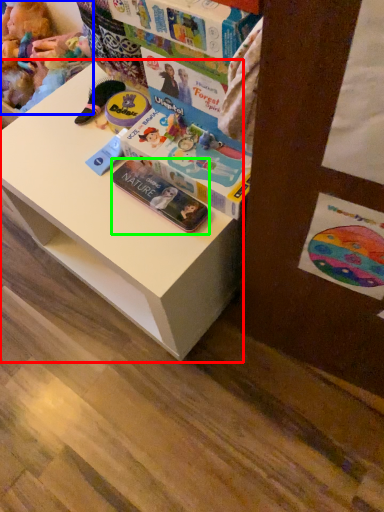
Question: Estimate the real-world distances between objects in this image. Which object is farther from changing table (highlighted by a red box), toy (highlighted by a blue box) or paperback book (highlighted by a green box)?

Choices:
 (A) toy
 (B) paperback book

Answer: (A)